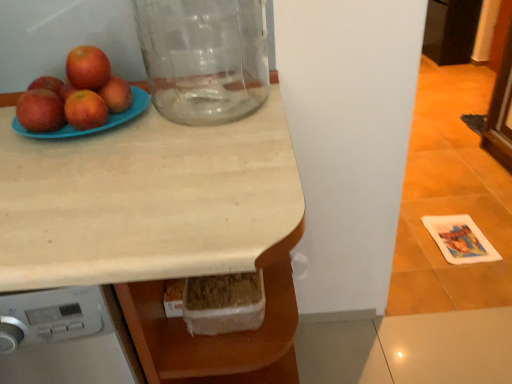
In order to click on vacant area that lies in front of transparent glass jar at upper left in this screenshot , I will do `click(212, 148)`.